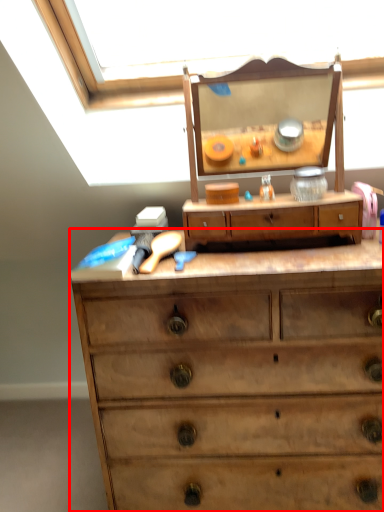
Question: From the image's perspective, considering the relative positions of chest of drawers (annotated by the red box) and drawer in the image provided, where is chest of drawers (annotated by the red box) located with respect to the staircase?

Choices:
 (A) below
 (B) above

Answer: (A)